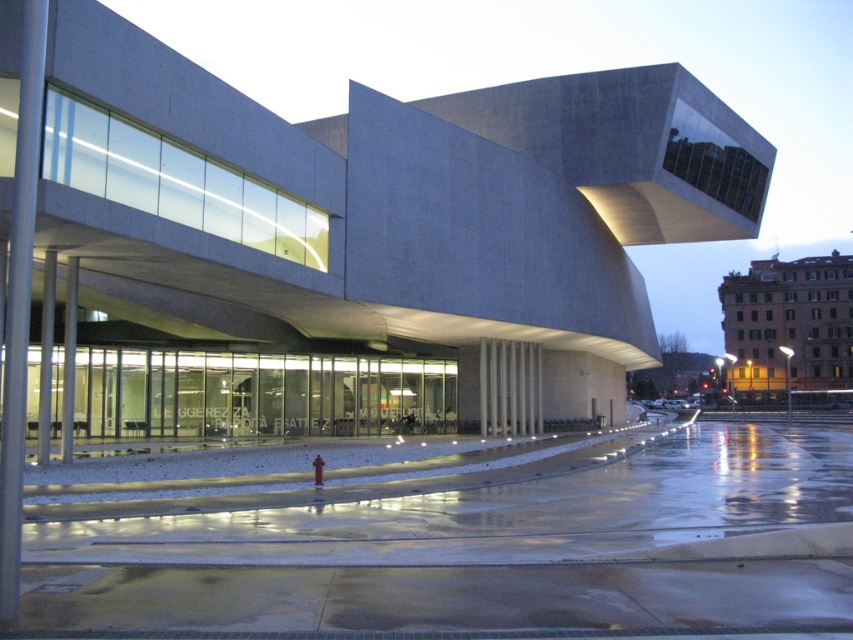
Can you confirm if yellow brick building at right is taller than red matte hydrant at lower center?

Yes, yellow brick building at right is taller than red matte hydrant at lower center.

Is point (790, 262) more distant than point (315, 456)?

Yes, point (790, 262) is farther from viewer.

The image size is (853, 640). I want to click on yellow brick building at right, so click(788, 323).

Is concrete building at center further to camera compared to red matte hydrant at lower center?

No.

Is point (27, 253) positioned before point (320, 483)?

Yes, point (27, 253) is in front of point (320, 483).

The width and height of the screenshot is (853, 640). I want to click on concrete building at center, so click(340, 237).

Who is positioned more to the right, concrete building at center or yellow brick building at right?

yellow brick building at right is more to the right.

The height and width of the screenshot is (640, 853). What do you see at coordinates (340, 237) in the screenshot?
I see `concrete building at center` at bounding box center [340, 237].

Where is `concrete building at center`? The image size is (853, 640). concrete building at center is located at coordinates (340, 237).